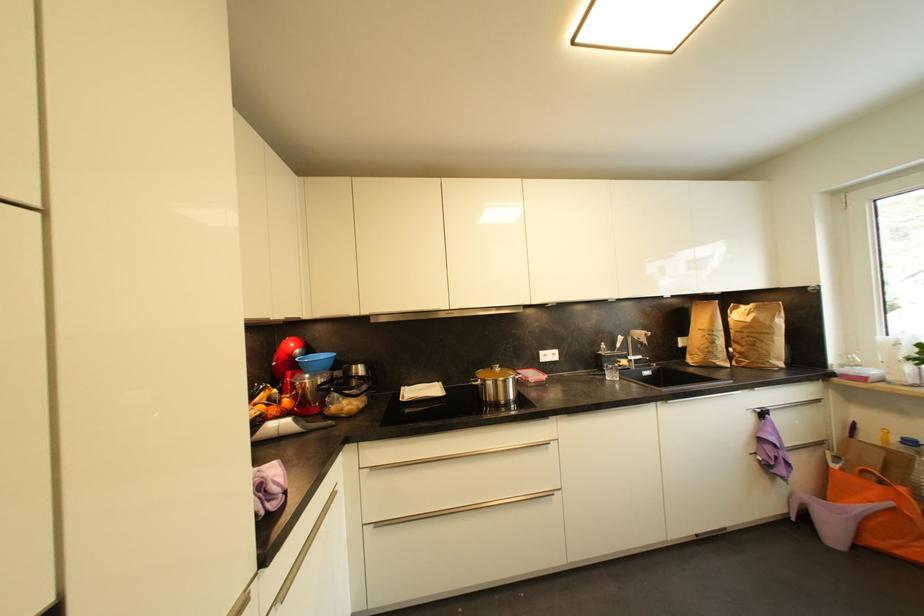
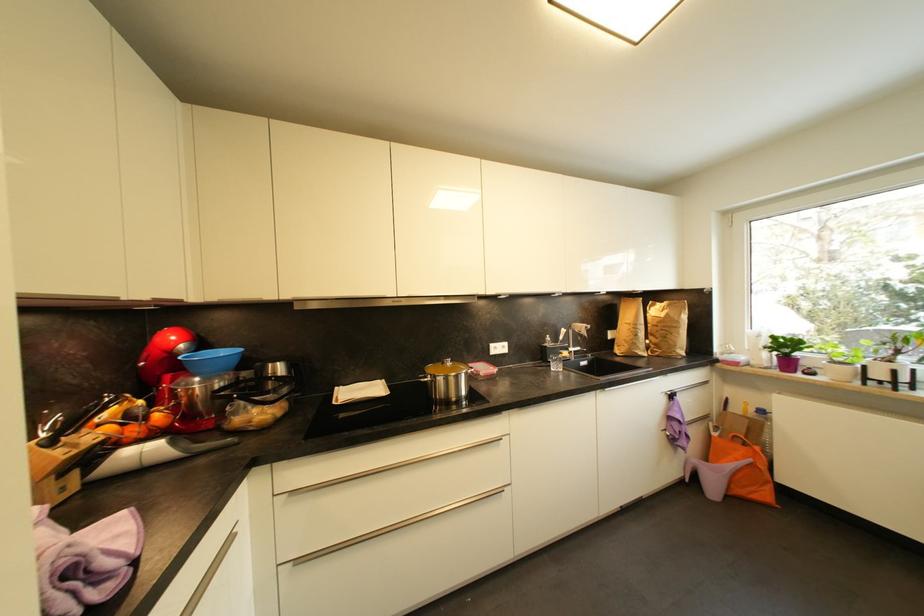
Question: In a continuous first-person perspective shot, in which direction is the camera moving?

Choices:
 (A) Left
 (B) Right
 (C) Forward
 (D) Backward

Answer: (C)